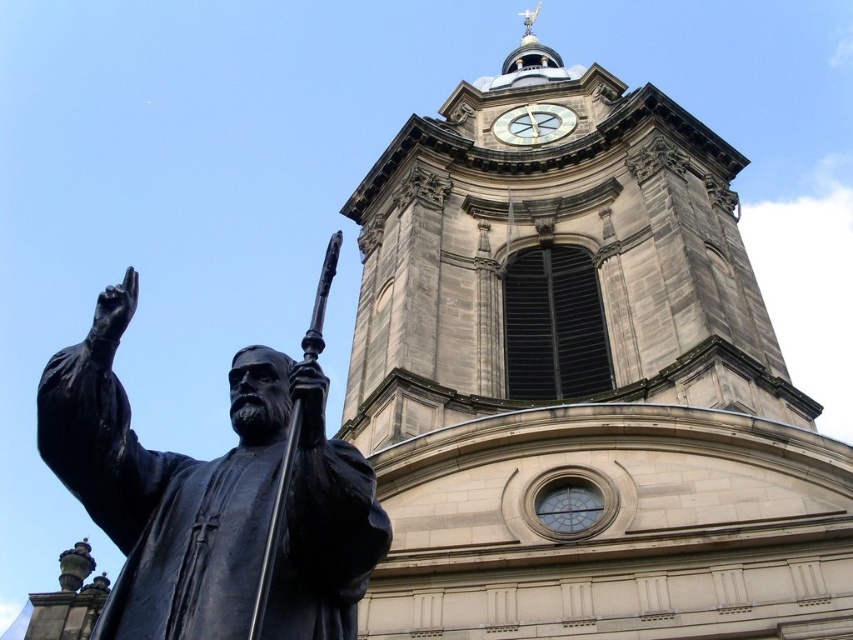
You are an architect assessing the proportions of the scene. Which object, the black polished statue at left or the white stone clock at upper center, has a greater height in the image?

The black polished statue at left is taller than the white stone clock at upper center.

You are an architect designing a new museum layout. You need to place a large sculpture in the entrance hall. The entrance hall has limited space, and you must ensure that the sculpture does not exceed the height of the ceiling, which is 3 meters. The black polished statue at left and the white stone clock at upper center are both candidates. Which object should you choose to ensure it fits under the ceiling?

The black polished statue at left is bigger than the white stone clock at upper center. Since the entrance hall ceiling is 3 meters, you should choose the smaller white stone clock at upper center to ensure it fits under the ceiling.

You are a tour guide standing at the entrance of the cathedral. A tourist asks if they can take a photo of the black polished statue at left without moving too far from where they are standing. Based on the statue being 22.06 meters away, can they take a clear photo using a standard smartphone camera with a typical zoom capability?

The black polished statue at left is 22.06 meters away from the camera. A standard smartphone camera can typically focus and capture clear images up to 10 meters. Therefore, the tourist would need to move closer or use additional zoom to get a clear photo.